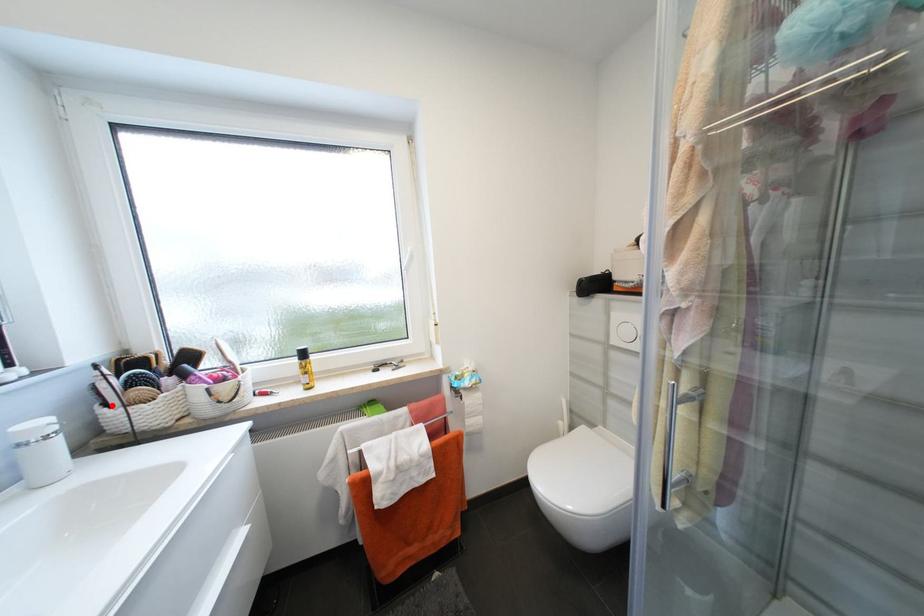
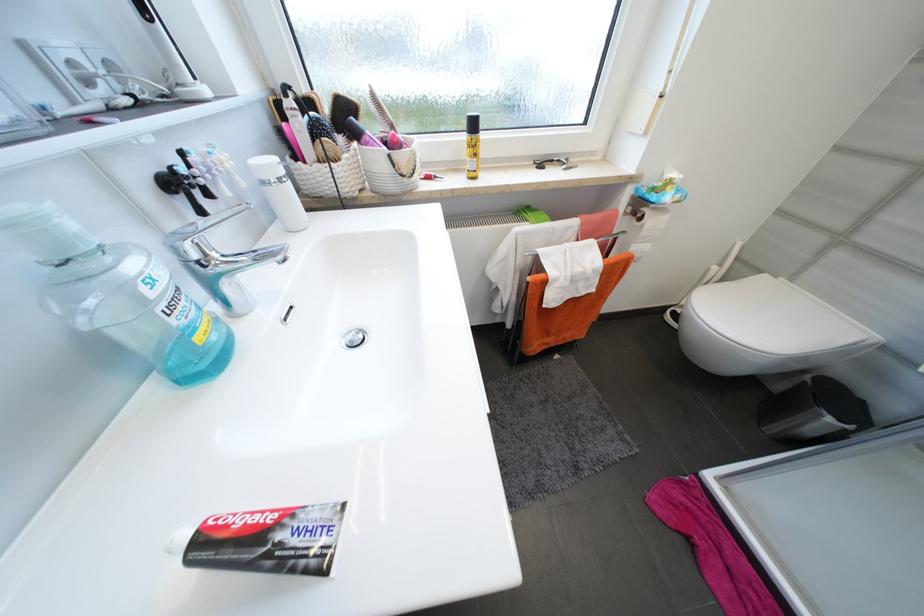
Locate, in the second image, the point that corresponds to the highlighted location in the first image.

(304, 158)